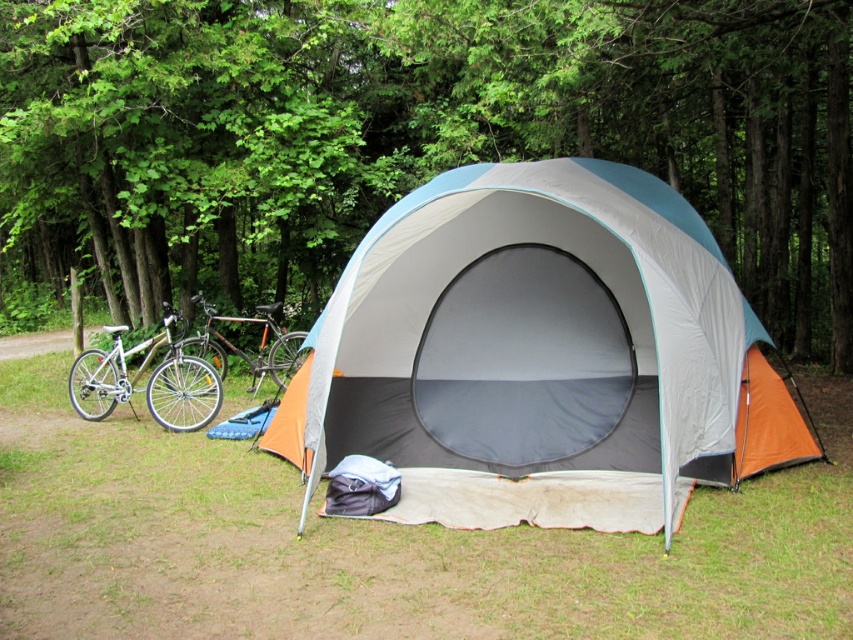
You are standing at the campsite and want to take a photo of the green leafy tree at center. If your camera has a maximum focus range of 6 meters, will you need to move closer to the tree to capture it clearly?

The green leafy tree at center is 6.63 meters away from you, which exceeds the camera maximum focus range of 6 meters. You need to move closer to the tree to capture it clearly.

You are planning to set up a tent in the forest. You have an orange fabric tent at center and a silver metallic bicycle at left. Which object is taller?

The orange fabric tent at center is much taller than the silver metallic bicycle at left according to the description.